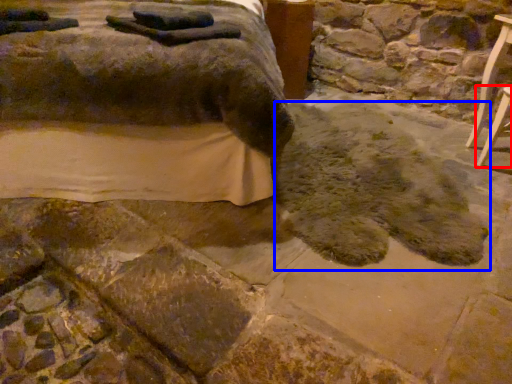
Question: Among these objects, which one is farthest to the camera, furniture (highlighted by a red box) or footprint (highlighted by a blue box)?

Choices:
 (A) furniture
 (B) footprint

Answer: (A)